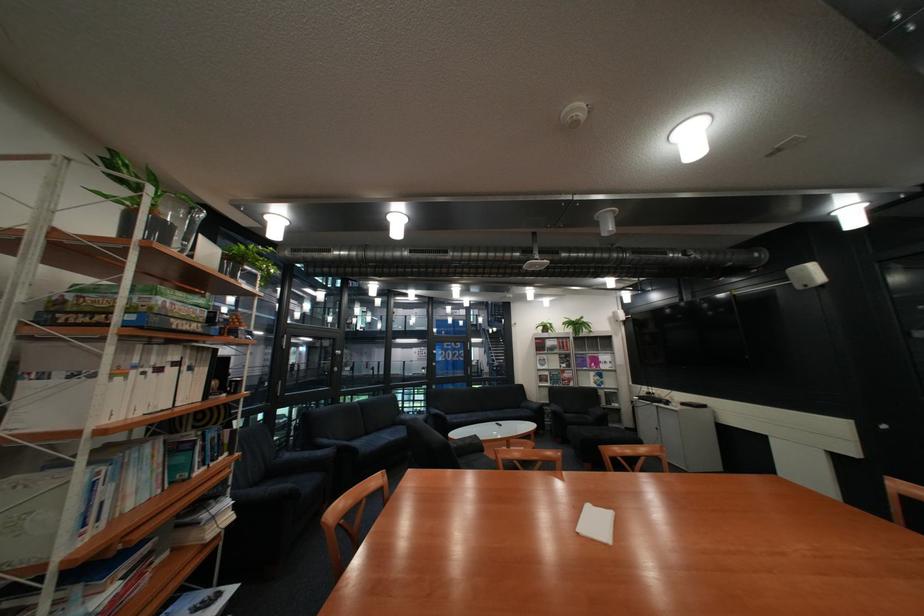
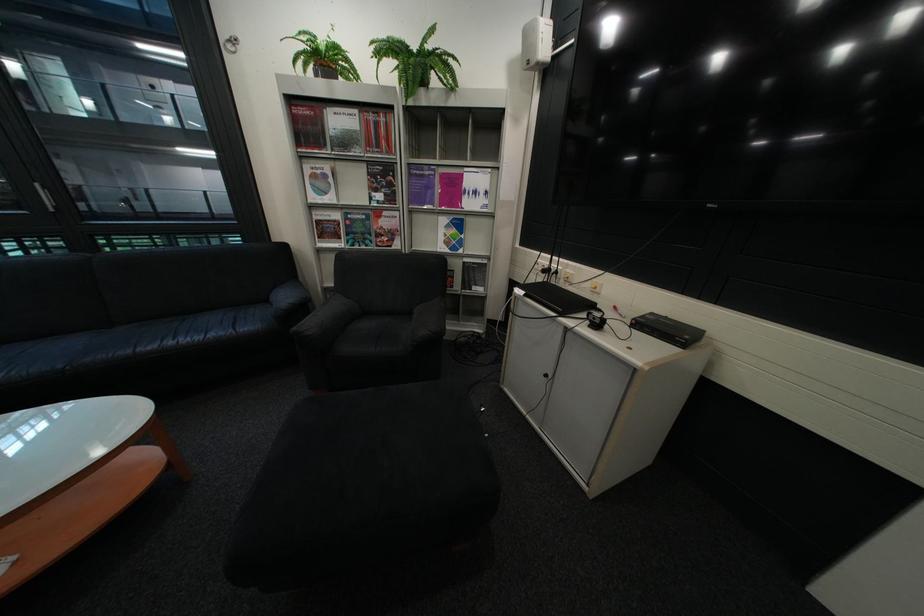
In the second image, find the point that corresponds to (554,360) in the first image.

(329, 177)